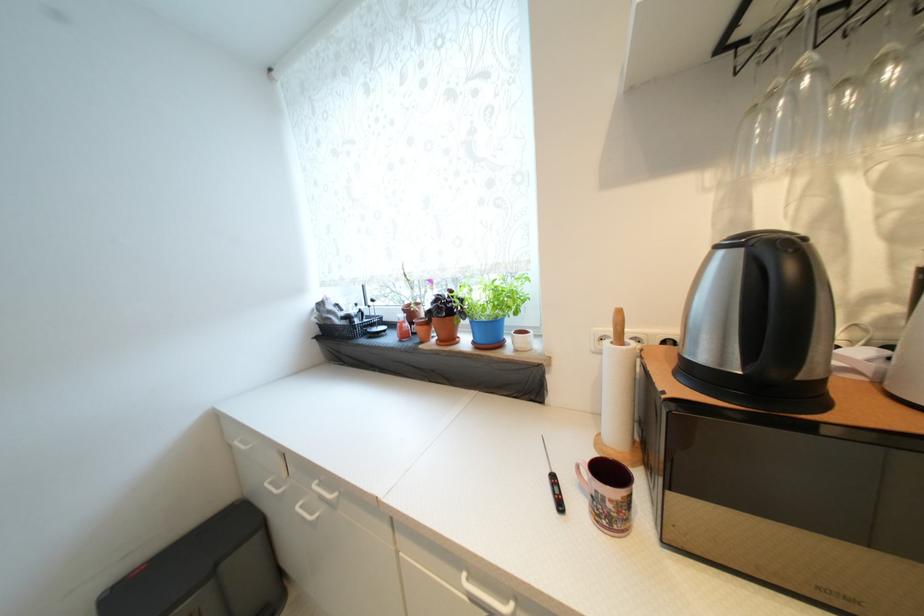
Which object does [445,330] point to?

It refers to a brown plant pot.